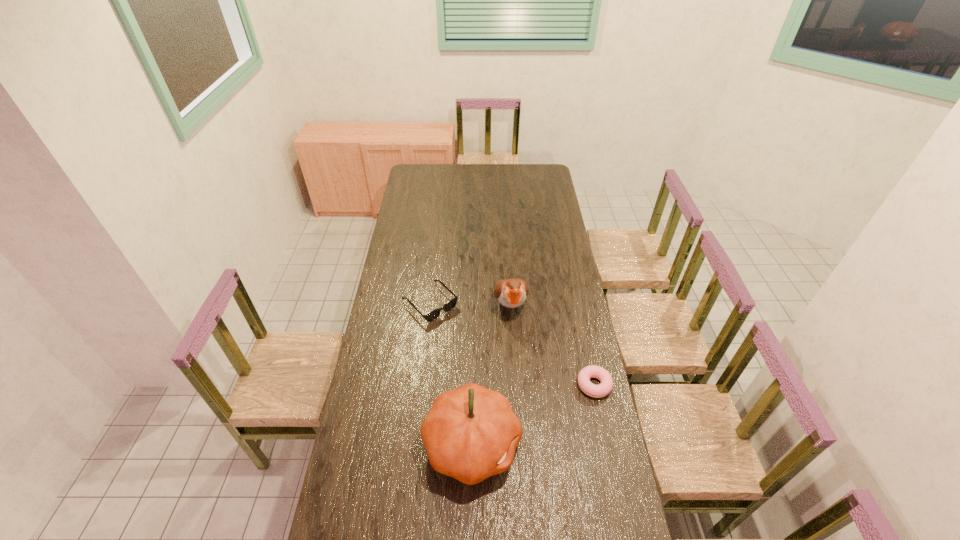
Locate an element on the screen. the nearest object is located at coordinates (471, 433).

Image resolution: width=960 pixels, height=540 pixels. I want to click on the second nearest object, so click(605, 387).

Where is `doughnut`? This screenshot has width=960, height=540. doughnut is located at coordinates (605, 387).

The width and height of the screenshot is (960, 540). Find the location of `bird`. bird is located at coordinates (511, 293).

Where is `sunglasses`? The image size is (960, 540). sunglasses is located at coordinates (434, 314).

Where is `free space located 0.300m on the front face of the pumpkin`? The image size is (960, 540). free space located 0.300m on the front face of the pumpkin is located at coordinates (606, 444).

This screenshot has width=960, height=540. I want to click on vacant area located 0.090m on the back of the third farthest object, so click(x=588, y=352).

Where is `vacant space located at the face of the bird`? The width and height of the screenshot is (960, 540). vacant space located at the face of the bird is located at coordinates (515, 339).

Locate an element on the screen. This screenshot has width=960, height=540. vacant space located at the face of the bird is located at coordinates (520, 372).

Locate an element on the screen. The height and width of the screenshot is (540, 960). vacant position located 0.100m at the face of the bird is located at coordinates (516, 348).